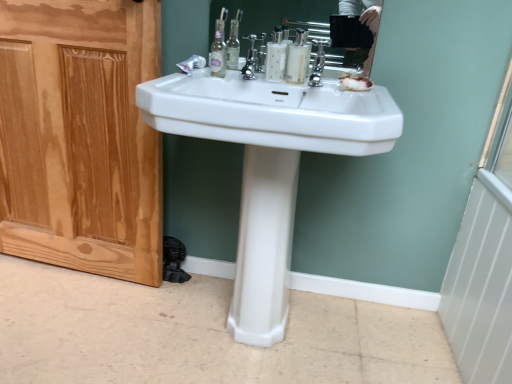
Question: Can you confirm if polished chrome tap at center is thinner than white glossy mouthwash at center, the 2th mouthwash viewed from the right?

Choices:
 (A) yes
 (B) no

Answer: (B)

Question: Is polished chrome tap at center behind white glossy mouthwash at center, the 2th mouthwash viewed from the right?

Choices:
 (A) no
 (B) yes

Answer: (A)

Question: Does polished chrome tap at center touch white glossy mouthwash at center, marked as the first mouthwash in a left-to-right arrangement?

Choices:
 (A) no
 (B) yes

Answer: (A)

Question: Can you confirm if polished chrome tap at center is positioned to the left of white glossy mouthwash at center, marked as the first mouthwash in a left-to-right arrangement?

Choices:
 (A) yes
 (B) no

Answer: (B)

Question: Is polished chrome tap at center located outside white glossy mouthwash at center, the 2th mouthwash viewed from the right?

Choices:
 (A) yes
 (B) no

Answer: (A)

Question: Can you confirm if polished chrome tap at center is positioned to the right of white glossy mouthwash at center, the 2th mouthwash viewed from the right?

Choices:
 (A) no
 (B) yes

Answer: (B)

Question: Can you confirm if marbled white soap at center is bigger than white glossy mouthwash at center, the 2th mouthwash viewed from the right?

Choices:
 (A) yes
 (B) no

Answer: (B)

Question: Is marbled white soap at center thinner than white glossy mouthwash at center, the 2th mouthwash viewed from the right?

Choices:
 (A) no
 (B) yes

Answer: (A)

Question: From a real-world perspective, is marbled white soap at center physically above white glossy mouthwash at center, marked as the first mouthwash in a left-to-right arrangement?

Choices:
 (A) no
 (B) yes

Answer: (A)

Question: Are marbled white soap at center and white glossy mouthwash at center, marked as the first mouthwash in a left-to-right arrangement, far apart?

Choices:
 (A) yes
 (B) no

Answer: (B)

Question: Does marbled white soap at center appear on the right side of white glossy mouthwash at center, marked as the first mouthwash in a left-to-right arrangement?

Choices:
 (A) yes
 (B) no

Answer: (A)

Question: Is marbled white soap at center not within white glossy mouthwash at center, the 2th mouthwash viewed from the right?

Choices:
 (A) no
 (B) yes

Answer: (B)

Question: Is natural wood screen door at left further to the viewer compared to white glossy sink at center?

Choices:
 (A) no
 (B) yes

Answer: (B)